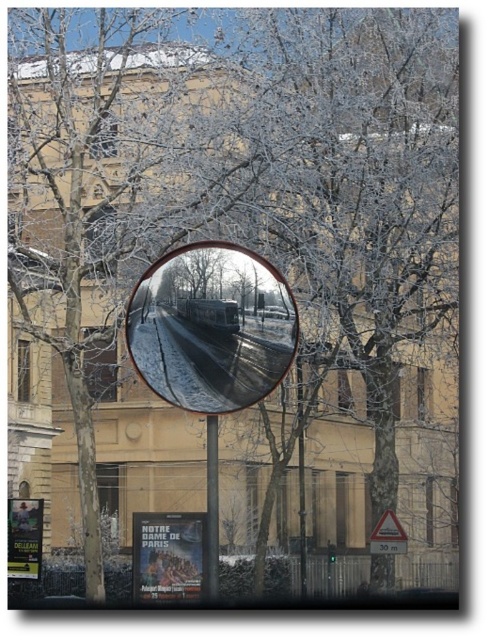
Can you confirm if metallic pole at center is positioned to the right of yellow plastic triangle at lower right?

In fact, metallic pole at center is to the left of yellow plastic triangle at lower right.

Does metallic pole at center come in front of yellow plastic triangle at lower right?

Yes, metallic pole at center is closer to the viewer.

You are a GUI agent. You are given a task and a screenshot of the screen. Output one action in this format:
    pyautogui.click(x=<x>, y=<y>)
    Task: Click on the metallic pole at center
    The height and width of the screenshot is (640, 489).
    Given the screenshot: What is the action you would take?
    pyautogui.click(x=212, y=508)

Can you confirm if clear glass mirror at center is wider than yellow plastic triangle at lower right?

Indeed, clear glass mirror at center has a greater width compared to yellow plastic triangle at lower right.

Between point (131, 330) and point (390, 512), which one is positioned behind?

The point (390, 512) is behind.

At what (x,y) coordinates should I click in order to perform the action: click on clear glass mirror at center. Please return your answer as a coordinate pair (x, y). This screenshot has height=640, width=489. Looking at the image, I should click on (210, 326).

Can you confirm if clear glass mirror at center is positioned to the left of metallic pole at center?

Incorrect, clear glass mirror at center is not on the left side of metallic pole at center.

Which is below, clear glass mirror at center or metallic pole at center?

metallic pole at center

Is point (250, 276) less distant than point (206, 500)?

Yes.

The width and height of the screenshot is (489, 640). In order to click on clear glass mirror at center in this screenshot , I will do `click(210, 326)`.